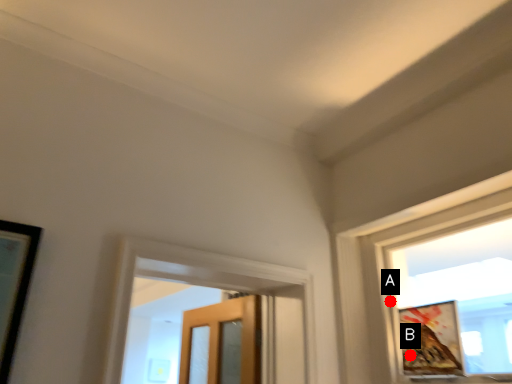
Question: Two points are circled on the image, labeled by A and B beside each circle. Which point is closer to the camera?

Choices:
 (A) A is closer
 (B) B is closer

Answer: (B)